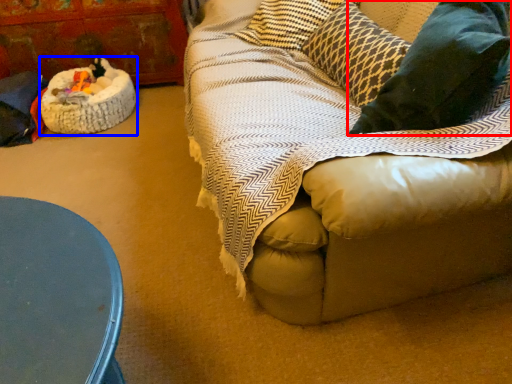
Question: Which object appears farthest to the camera in this image, throw pillow (highlighted by a red box) or cat bed (highlighted by a blue box)?

Choices:
 (A) throw pillow
 (B) cat bed

Answer: (B)